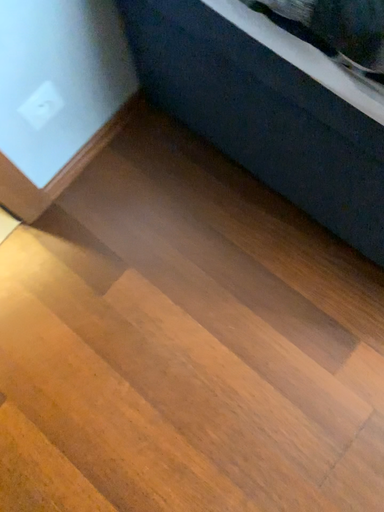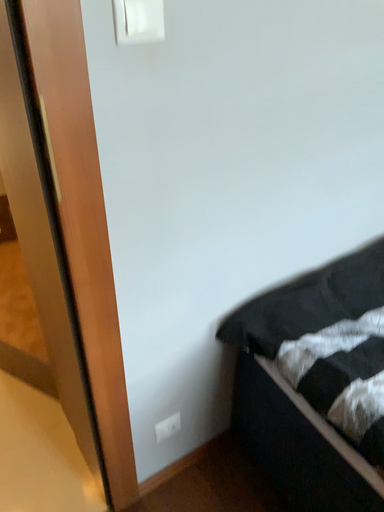
Question: How did the camera likely rotate when shooting the video?

Choices:
 (A) rotated downward
 (B) rotated upward

Answer: (B)